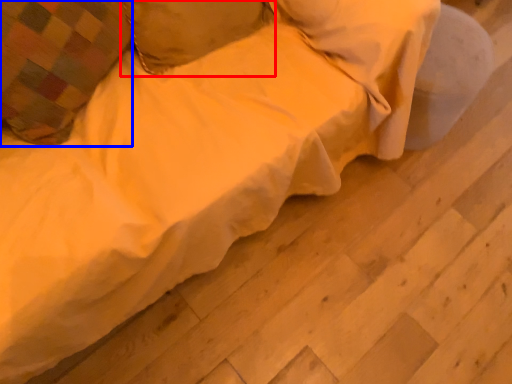
Question: Which point is closer to the camera, pillow (highlighted by a red box) or pillow (highlighted by a blue box)?

Choices:
 (A) pillow
 (B) pillow

Answer: (B)